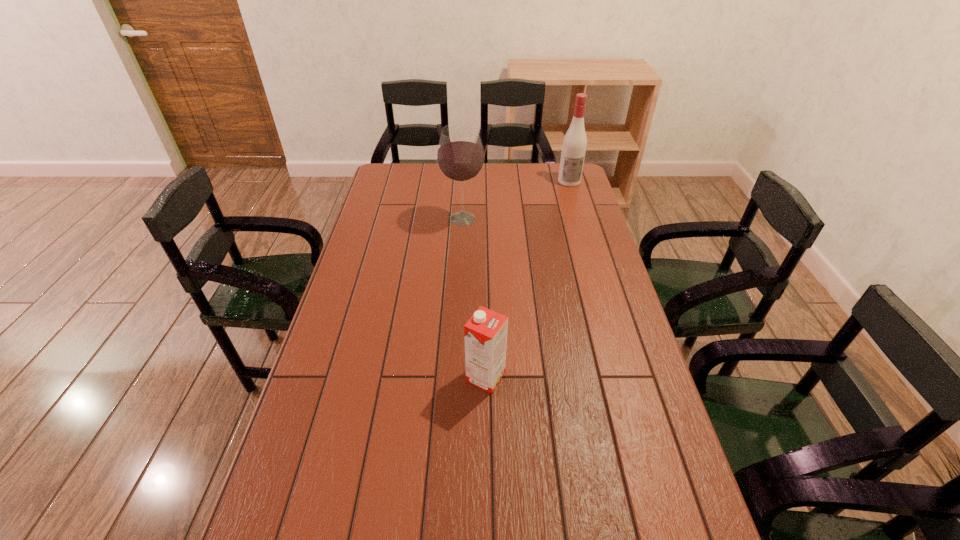
This screenshot has height=540, width=960. I want to click on the farthest object, so click(574, 145).

This screenshot has height=540, width=960. Identify the location of the rightmost object. (574, 145).

What are the coordinates of `the second farthest object` in the screenshot? It's located at (460, 157).

The height and width of the screenshot is (540, 960). I want to click on the nearer alcohol, so click(460, 157).

This screenshot has height=540, width=960. What are the coordinates of `the nearest object` in the screenshot? It's located at (485, 333).

Where is `the shortest object`? The image size is (960, 540). the shortest object is located at coordinates (485, 333).

Identify the location of vacant space located on the label of the farther alcohol. The height and width of the screenshot is (540, 960). (588, 243).

Find the location of `vacant space located on the right of the nearer alcohol`. vacant space located on the right of the nearer alcohol is located at coordinates (542, 219).

Image resolution: width=960 pixels, height=540 pixels. I want to click on vacant space located 0.270m on the back of the shortest object, so click(485, 294).

This screenshot has width=960, height=540. I want to click on object at the far edge, so click(574, 145).